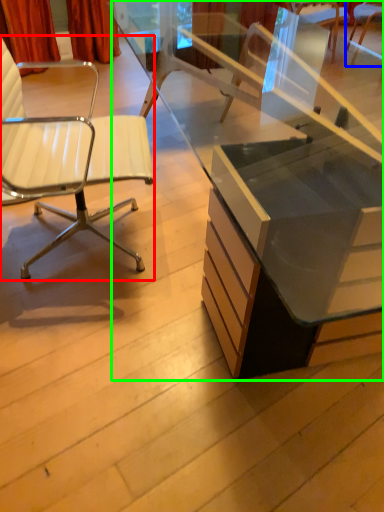
Question: Estimate the real-world distances between objects in this image. Which object is farther from chair (highlighted by a red box), chair (highlighted by a blue box) or desk (highlighted by a green box)?

Choices:
 (A) chair
 (B) desk

Answer: (A)